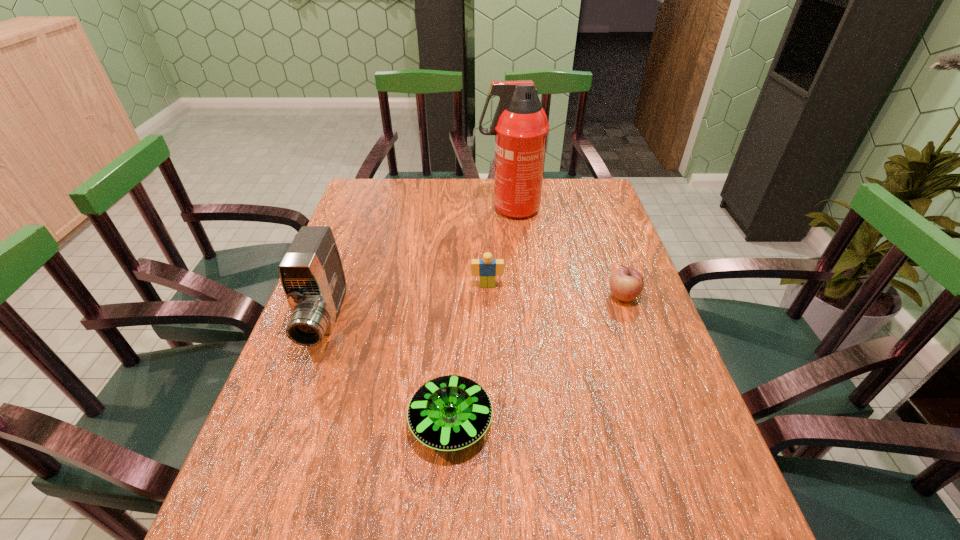
Locate an element on the screen. The image size is (960, 540). vacant area between the second tallest object and the Lego is located at coordinates (406, 303).

Locate which object is the fourth closest to the Lego. Please provide its 2D coordinates. Your answer should be formatted as a tuple, i.e. [(x, y)], where the tuple contains the x and y coordinates of a point satisfying the conditions above.

[(448, 413)]

Image resolution: width=960 pixels, height=540 pixels. Find the location of `object that is the closest to the shortest object`. object that is the closest to the shortest object is located at coordinates coord(311,272).

This screenshot has width=960, height=540. In order to click on vacant position in the image that satisfies the following two spatial constraints: 1. on the face of the rightmost object; 2. on the left side of the Lego in this screenshot , I will do `click(488, 296)`.

Find the location of `free space that satisfies the following two spatial constraints: 1. at the front of the shortest object, highlighting the lens; 2. on the right side of the camcorder`. free space that satisfies the following two spatial constraints: 1. at the front of the shortest object, highlighting the lens; 2. on the right side of the camcorder is located at coordinates (288, 422).

You are a GUI agent. You are given a task and a screenshot of the screen. Output one action in this format:
    pyautogui.click(x=<x>, y=<y>)
    Task: Click on the vacant space that satisfies the following two spatial constraints: 1. on the back side of the rightmost object; 2. on the right side of the shortest object
    The image size is (960, 540).
    Given the screenshot: What is the action you would take?
    pyautogui.click(x=458, y=296)

Find the location of a particular element. The image size is (960, 540). free space that satisfies the following two spatial constraints: 1. on the trigger side of the farthest object; 2. at the front of the leftmost object, highlighting the lens is located at coordinates (520, 320).

At what (x,y) coordinates should I click in order to perform the action: click on vacant space that satisfies the following two spatial constraints: 1. on the trigger side of the farthest object; 2. at the front of the camcorder, highlighting the lens. Please return your answer as a coordinate pair (x, y). This screenshot has width=960, height=540. Looking at the image, I should click on (520, 320).